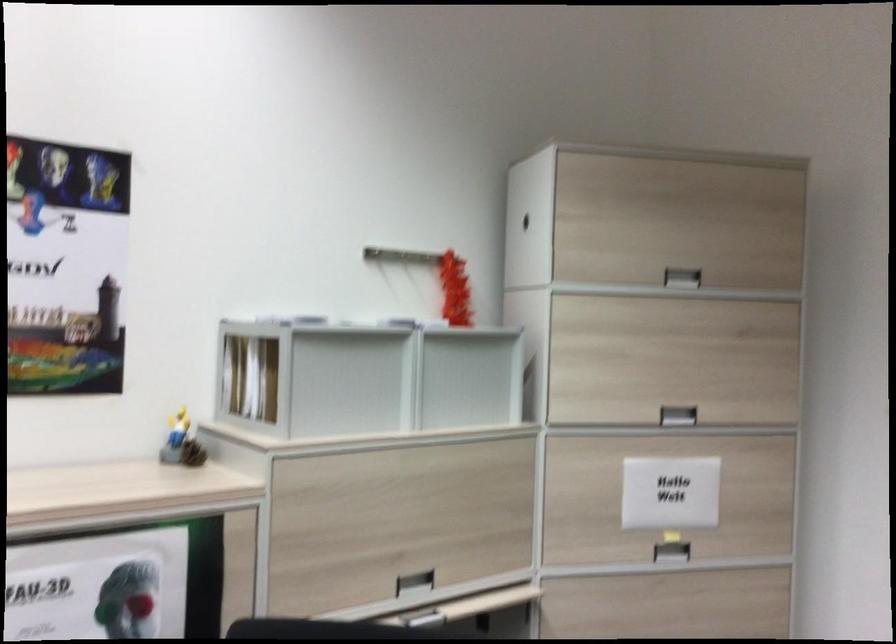
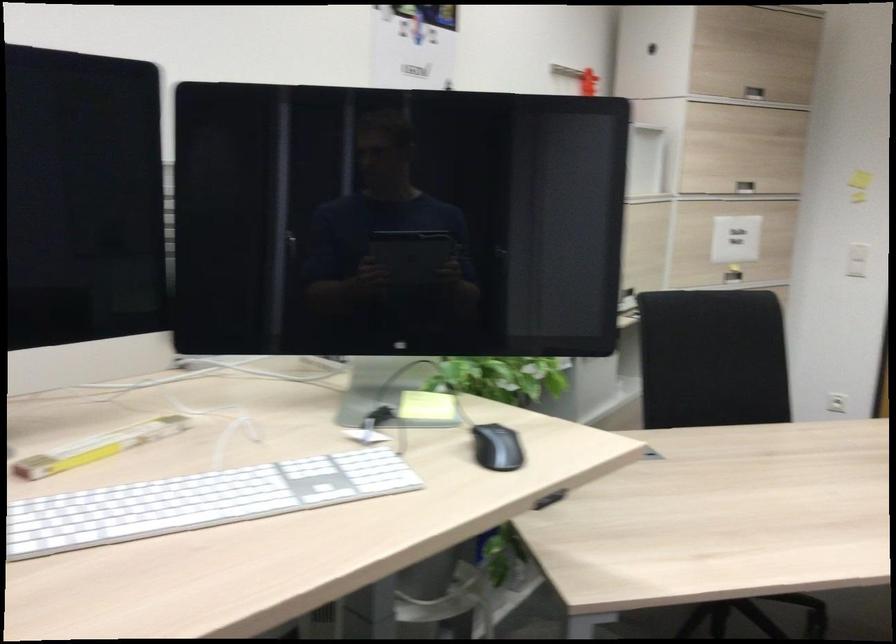
The point at (x=660, y=415) is marked in the first image. Where is the corresponding point in the second image?

(745, 187)